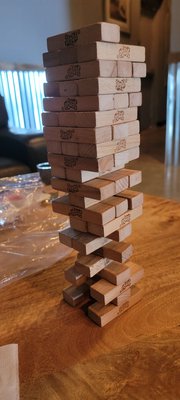
Find the location of a particular element. The height and width of the screenshot is (400, 180). vertical blinds is located at coordinates (21, 122), (24, 93), (9, 87), (100, 369).